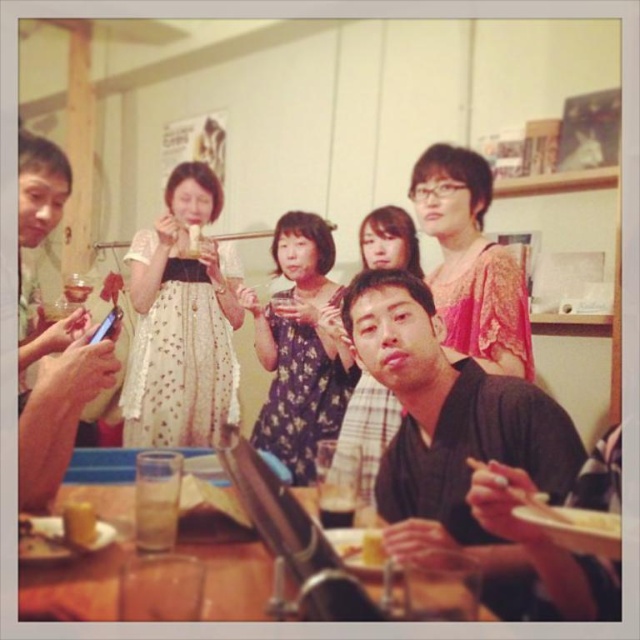
Between translucent glass at lower left and yellow matte cake at center, which one has less height?

yellow matte cake at center is shorter.

Locate an element on the screen. translucent glass at lower left is located at coordinates (156, 522).

Locate an element on the screen. translucent glass at lower left is located at coordinates (156, 522).

This screenshot has width=640, height=640. I want to click on black matte kimono at center, so click(451, 436).

Based on the photo, does black matte kimono at center have a lesser width compared to clear glass at upper left?

No, black matte kimono at center is not thinner than clear glass at upper left.

Locate an element on the screen. black matte kimono at center is located at coordinates pos(451,436).

Between translucent glass at lower left and yellow matte cupcake at lower left, which one is positioned higher?

yellow matte cupcake at lower left is above.

Describe the element at coordinates (156, 522) in the screenshot. I see `translucent glass at lower left` at that location.

Who is more forward, (161, 552) or (67, 504)?

Point (161, 552)

This screenshot has height=640, width=640. I want to click on translucent glass at lower left, so click(156, 522).